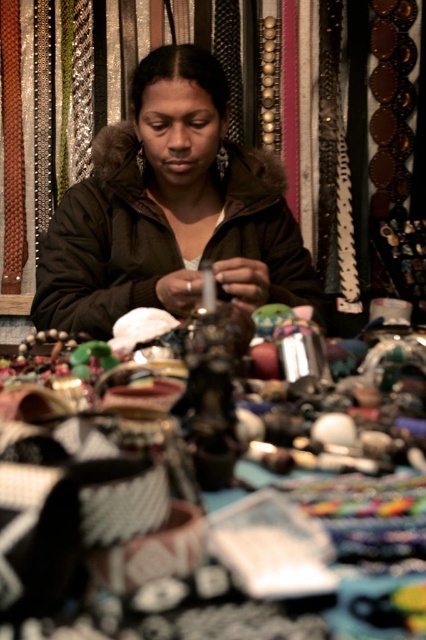
Question: Does metallic silver bangles at center come behind matte brown jacket at center?

Choices:
 (A) yes
 (B) no

Answer: (B)

Question: Which point is farther from the camera taking this photo?

Choices:
 (A) (146, 467)
 (B) (78, 227)

Answer: (B)

Question: Which point appears farthest from the camera in this image?

Choices:
 (A) click(313, 548)
 (B) click(109, 224)

Answer: (B)

Question: Does metallic silver bangles at center have a smaller size compared to matte brown jacket at center?

Choices:
 (A) no
 (B) yes

Answer: (B)

Question: Does metallic silver bangles at center have a larger size compared to matte brown jacket at center?

Choices:
 (A) no
 (B) yes

Answer: (A)

Question: Which point appears closest to the camera in this image?

Choices:
 (A) [x=20, y=563]
 (B) [x=199, y=192]

Answer: (A)